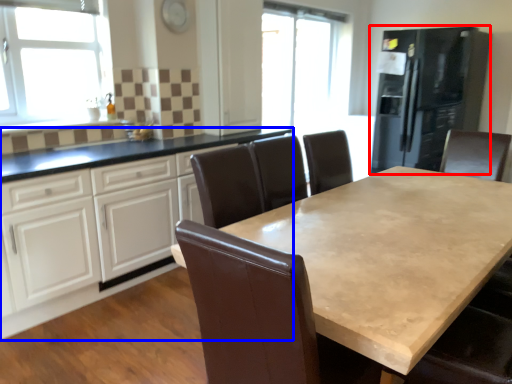
Question: Which object is further to the camera taking this photo, fridge (highlighted by a red box) or cabinetry (highlighted by a blue box)?

Choices:
 (A) fridge
 (B) cabinetry

Answer: (A)